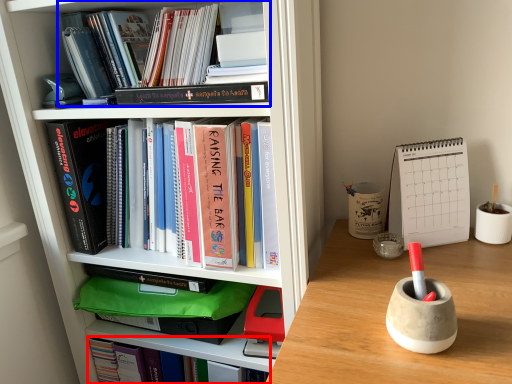
Question: Which object is closer to the camera taking this photo, book (highlighted by a red box) or book (highlighted by a blue box)?

Choices:
 (A) book
 (B) book

Answer: (B)